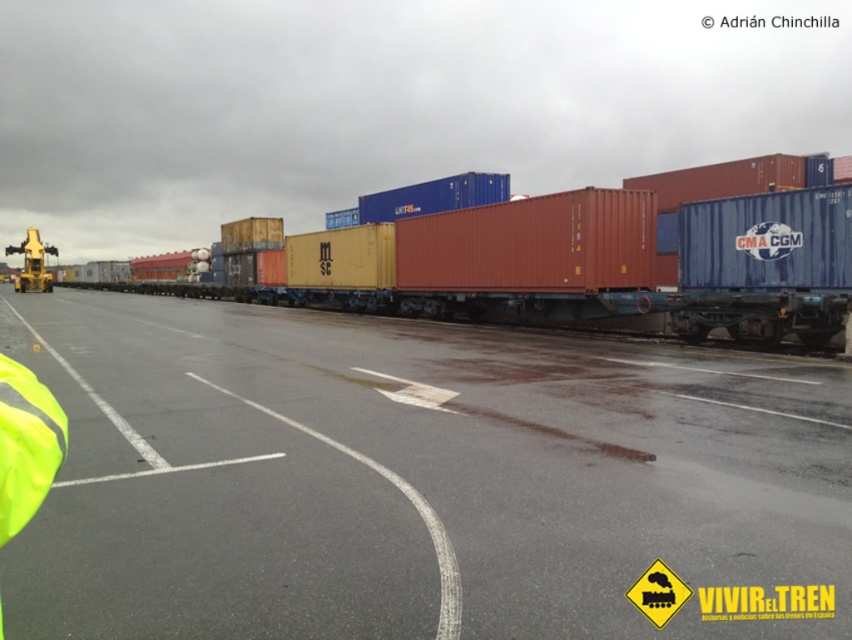
Is red matte container at center below yellow reflective safety vest at lower left?

No.

Is red matte container at center bigger than yellow reflective safety vest at lower left?

Yes.

Measure the distance between point (x=632, y=272) and camera.

Point (x=632, y=272) is 19.90 meters from camera.

You are a GUI agent. You are given a task and a screenshot of the screen. Output one action in this format:
    pyautogui.click(x=<x>, y=<y>)
    Task: Click on the red matte container at center
    Image resolution: width=852 pixels, height=640 pixels.
    Given the screenshot: What is the action you would take?
    pyautogui.click(x=603, y=257)

The image size is (852, 640). What are the coordinates of `matte red container at center` in the screenshot? It's located at click(x=528, y=257).

Between point (491, 252) and point (0, 355), which one is positioned in front?

Point (0, 355)

Which is in front, point (426, 316) or point (3, 355)?

Point (3, 355) is more forward.

I want to click on matte red container at center, so click(x=528, y=257).

Measure the distance between matte red container at center and camera.

60.18 feet

Can you confirm if matte red container at center is wider than blue matte container at center-right?

Indeed, matte red container at center has a greater width compared to blue matte container at center-right.

Which is behind, point (440, 308) or point (734, 305)?

The point (440, 308) is more distant.

At what (x,y) coordinates should I click in order to perform the action: click on matte red container at center. Please return your answer as a coordinate pair (x, y). The image size is (852, 640). Looking at the image, I should click on (528, 257).